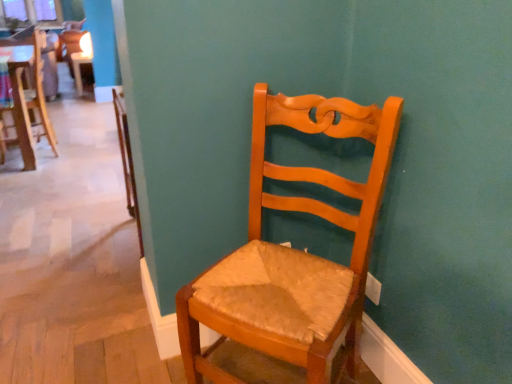
Find the location of a particular element. This screenshot has height=384, width=512. wooden chair at center, the second chair positioned from the right is located at coordinates (27, 93).

The image size is (512, 384). Find the location of `wooden chair at center, the 3th chair viewed from the right`. wooden chair at center, the 3th chair viewed from the right is located at coordinates (77, 53).

Describe the element at coordinates (77, 53) in the screenshot. I see `wooden chair at center, the 3th chair viewed from the right` at that location.

At what (x,y) coordinates should I click in order to perform the action: click on wooden chair at center, the second chair positioned from the right. Please return your answer as a coordinate pair (x, y). This screenshot has width=512, height=384. Looking at the image, I should click on (27, 93).

Considering the points (19, 79) and (271, 101), which point is behind, point (19, 79) or point (271, 101)?

The point (19, 79) is behind.

Which of these two, wooden chair at center, which ranks as the 2th chair in left-to-right order, or wooden chair with woven seat cushion at center, positioned as the 1th chair in right-to-left order, stands shorter?

Standing shorter between the two is wooden chair with woven seat cushion at center, positioned as the 1th chair in right-to-left order.

From a real-world perspective, is wooden chair at center, the 2th chair when ordered from top to bottom, below wooden chair with woven seat cushion at center, the third chair positioned from the left?

No, from a real-world perspective, wooden chair at center, the 2th chair when ordered from top to bottom, is not under wooden chair with woven seat cushion at center, the third chair positioned from the left.

Where is `the 1st chair to the left when counting from the wooden chair with woven seat cushion at center, positioned as the 1th chair in right-to-left order`? the 1st chair to the left when counting from the wooden chair with woven seat cushion at center, positioned as the 1th chair in right-to-left order is located at coordinates (27, 93).

How many degrees apart are the facing directions of wooden chair at center, the 3th chair when ordered from bottom to top, and wooden chair with woven seat cushion at center, arranged as the third chair when viewed from the back?

wooden chair at center, the 3th chair when ordered from bottom to top, and wooden chair with woven seat cushion at center, arranged as the third chair when viewed from the back, are facing 123 degrees away from each other.

Between wooden chair at center, the first chair viewed from the left, and wooden chair with woven seat cushion at center, arranged as the third chair when viewed from the back, which one has less height?

Standing shorter between the two is wooden chair at center, the first chair viewed from the left.

From the image's perspective, is wooden chair at center, the first chair from the top, beneath wooden chair with woven seat cushion at center, arranged as the third chair when viewed from the back?

No, from the image's perspective, wooden chair at center, the first chair from the top, is not beneath wooden chair with woven seat cushion at center, arranged as the third chair when viewed from the back.

Based on their sizes in the image, would you say wooden chair at center, marked as the third chair in a front-to-back arrangement, is bigger or smaller than wooden chair with woven seat cushion at center, acting as the 3th chair starting from the top?

In the image, wooden chair at center, marked as the third chair in a front-to-back arrangement, appears to be smaller than wooden chair with woven seat cushion at center, acting as the 3th chair starting from the top.

Considering the sizes of wooden chair at center, the 3th chair viewed from the right, and wooden chair at center, the 2th chair when ordered from top to bottom, in the image, is wooden chair at center, the 3th chair viewed from the right, bigger or smaller than wooden chair at center, the 2th chair when ordered from top to bottom,?

Clearly, wooden chair at center, the 3th chair viewed from the right, is smaller in size than wooden chair at center, the 2th chair when ordered from top to bottom.

From the image's perspective, between wooden chair at center, the 3th chair viewed from the right, and wooden chair at center, the second chair in the back-to-front sequence, which one is located above?

wooden chair at center, the 3th chair viewed from the right.

Which is more to the right, wooden chair at center, placed as the 1th chair when sorted from back to front, or wooden chair at center, the second chair in the back-to-front sequence?

Positioned to the right is wooden chair at center, the second chair in the back-to-front sequence.

Which of these two, wooden chair at center, the first chair viewed from the left, or wooden chair at center, placed as the second chair when sorted from bottom to top, stands taller?

wooden chair at center, placed as the second chair when sorted from bottom to top.

Consider the image. Can you confirm if wooden chair at center, the second chair positioned from the right, is shorter than wooden chair at center, marked as the third chair in a front-to-back arrangement?

Incorrect, the height of wooden chair at center, the second chair positioned from the right, does not fall short of that of wooden chair at center, marked as the third chair in a front-to-back arrangement.

From the image's perspective, would you say wooden chair at center, the second chair in the back-to-front sequence, is shown under wooden chair at center, the first chair viewed from the left?

Yes, from the image's perspective, wooden chair at center, the second chair in the back-to-front sequence, is below wooden chair at center, the first chair viewed from the left.

Which is in front, wooden chair at center, the 2th chair when ordered from top to bottom, or wooden chair at center, the first chair from the top?

wooden chair at center, the 2th chair when ordered from top to bottom, is more forward.

Looking at their sizes, would you say wooden chair at center, the second chair in the back-to-front sequence, is wider or thinner than wooden chair at center, marked as the third chair in a front-to-back arrangement?

Clearly, wooden chair at center, the second chair in the back-to-front sequence, has more width compared to wooden chair at center, marked as the third chair in a front-to-back arrangement.

From the image's perspective, which one is positioned lower, wooden chair with woven seat cushion at center, arranged as the third chair when viewed from the back, or wooden chair at center, the 3th chair when ordered from bottom to top?

wooden chair with woven seat cushion at center, arranged as the third chair when viewed from the back, appears lower in the image.

How many degrees apart are the facing directions of wooden chair with woven seat cushion at center, positioned as the 1th chair in right-to-left order, and wooden chair at center, the 3th chair viewed from the right?

The angle between the facing direction of wooden chair with woven seat cushion at center, positioned as the 1th chair in right-to-left order, and the facing direction of wooden chair at center, the 3th chair viewed from the right, is 123 degrees.

Which is behind, point (247, 338) or point (67, 53)?

Point (67, 53)

Considering the sizes of objects wooden chair with woven seat cushion at center, which ranks as the first chair in front-to-back order, and wooden chair at center, the first chair viewed from the left, in the image provided, who is taller, wooden chair with woven seat cushion at center, which ranks as the first chair in front-to-back order, or wooden chair at center, the first chair viewed from the left,?

wooden chair with woven seat cushion at center, which ranks as the first chair in front-to-back order.

Considering the positions of points (307, 208) and (9, 71), is point (307, 208) farther from camera compared to point (9, 71)?

No, it is not.

Are wooden chair with woven seat cushion at center, which ranks as the first chair in front-to-back order, and wooden chair at center, the second chair positioned from the right, making contact?

wooden chair with woven seat cushion at center, which ranks as the first chair in front-to-back order, and wooden chair at center, the second chair positioned from the right, are not in contact.

Is wooden chair with woven seat cushion at center, which ranks as the first chair in front-to-back order, inside or outside of wooden chair at center, the 2th chair when ordered from top to bottom?

wooden chair with woven seat cushion at center, which ranks as the first chair in front-to-back order, cannot be found inside wooden chair at center, the 2th chair when ordered from top to bottom.

From the image's perspective, is wooden chair with woven seat cushion at center, arranged as the third chair when viewed from the back, located beneath wooden chair at center, placed as the second chair when sorted from bottom to top?

Yes, from the image's perspective, wooden chair with woven seat cushion at center, arranged as the third chair when viewed from the back, is below wooden chair at center, placed as the second chair when sorted from bottom to top.

From the image's perspective, starting from the wooden chair with woven seat cushion at center, arranged as the first chair when ordered from the bottom, which chair is the 1st one above? Please provide its 2D coordinates.

[(27, 93)]

From the image's perspective, count 2nd chairs downward from the wooden chair at center, marked as the third chair in a front-to-back arrangement, and point to it. Please provide its 2D coordinates.

[(293, 251)]

From the image, which object appears to be nearer to wooden chair at center, the 3th chair viewed from the right, wooden chair with woven seat cushion at center, positioned as the 1th chair in right-to-left order, or wooden chair at center, the second chair in the back-to-front sequence?

wooden chair at center, the second chair in the back-to-front sequence, lies closer to wooden chair at center, the 3th chair viewed from the right, than the other object.

Estimate the real-world distances between objects in this image. Which object is closer to wooden chair at center, placed as the second chair when sorted from bottom to top, wooden chair at center, the 3th chair when ordered from bottom to top, or wooden chair with woven seat cushion at center, acting as the 3th chair starting from the top?

wooden chair at center, the 3th chair when ordered from bottom to top, is closer to wooden chair at center, placed as the second chair when sorted from bottom to top.

From the image, which object appears to be nearer to wooden chair with woven seat cushion at center, which ranks as the first chair in front-to-back order, wooden chair at center, the 2th chair when ordered from top to bottom, or wooden chair at center, the 3th chair viewed from the right?

wooden chair at center, the 2th chair when ordered from top to bottom, is closer to wooden chair with woven seat cushion at center, which ranks as the first chair in front-to-back order.

Which object lies further to the anchor point wooden chair at center, the second chair positioned from the right, wooden chair with woven seat cushion at center, acting as the 3th chair starting from the top, or wooden chair at center, marked as the third chair in a front-to-back arrangement?

wooden chair with woven seat cushion at center, acting as the 3th chair starting from the top, is further to wooden chair at center, the second chair positioned from the right.

When comparing their distances from wooden chair at center, marked as the third chair in a front-to-back arrangement, does wooden chair at center, placed as the second chair when sorted from bottom to top, or wooden chair with woven seat cushion at center, arranged as the third chair when viewed from the back, seem further?

wooden chair with woven seat cushion at center, arranged as the third chair when viewed from the back, is further to wooden chair at center, marked as the third chair in a front-to-back arrangement.

Based on their spatial positions, is wooden chair at center, the first chair from the top, or wooden chair at center, the second chair in the back-to-front sequence, closer to wooden chair with woven seat cushion at center, the third chair positioned from the left?

wooden chair at center, the second chair in the back-to-front sequence, is closer to wooden chair with woven seat cushion at center, the third chair positioned from the left.

Find the location of a particular element. The width and height of the screenshot is (512, 384). chair located between wooden chair with woven seat cushion at center, positioned as the 1th chair in right-to-left order, and wooden chair at center, placed as the 1th chair when sorted from back to front, in the depth direction is located at coordinates [27, 93].